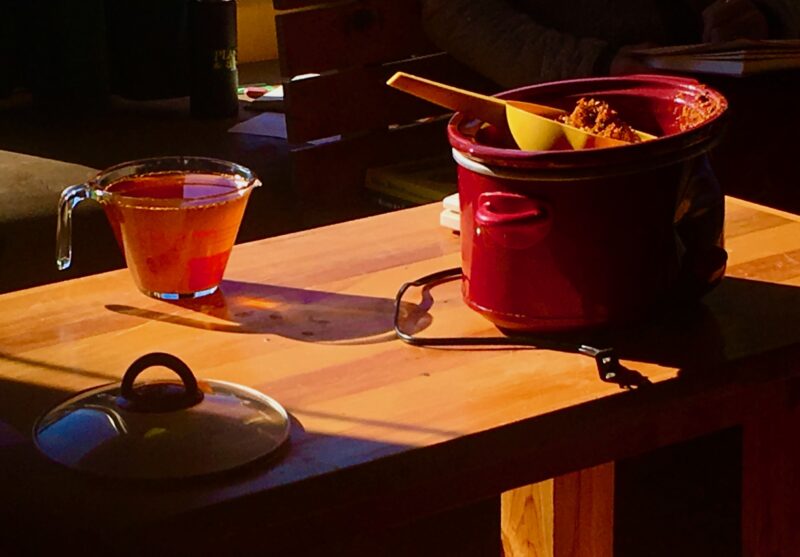
The height and width of the screenshot is (557, 800). I want to click on slow cooker, so click(573, 228).